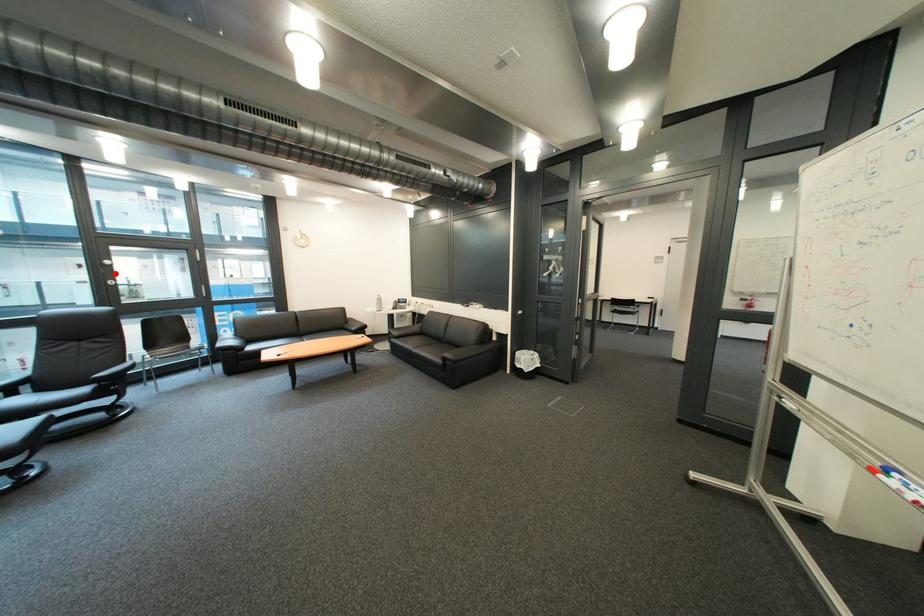
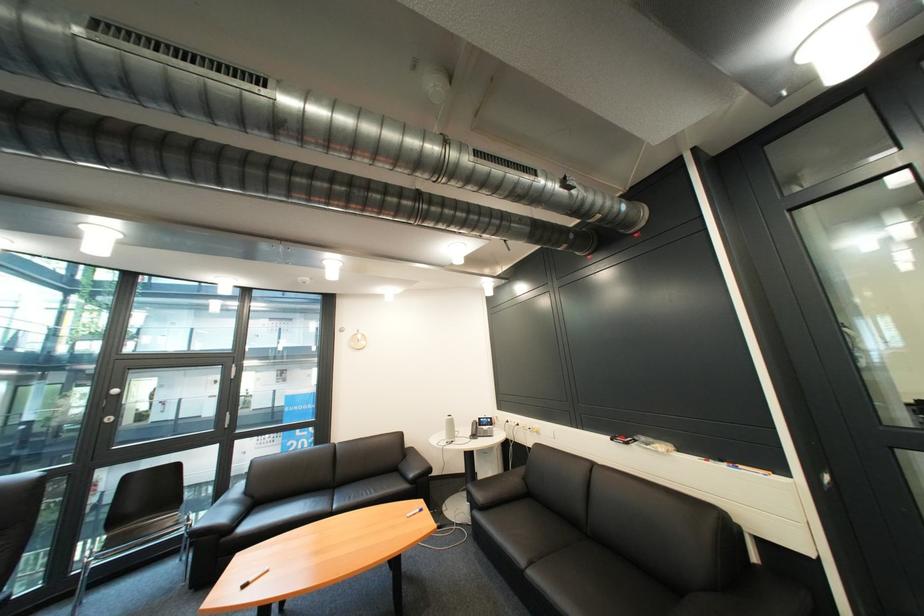
The point at the highlighted location is marked in the first image. Where is the corresponding point in the second image?

(118, 408)